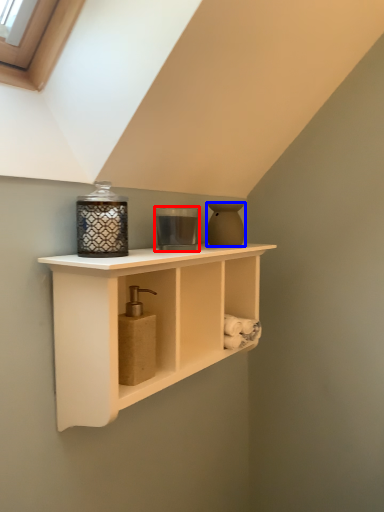
Question: Which point is further to the camera, candle holder (highlighted by a red box) or vase (highlighted by a blue box)?

Choices:
 (A) candle holder
 (B) vase

Answer: (B)